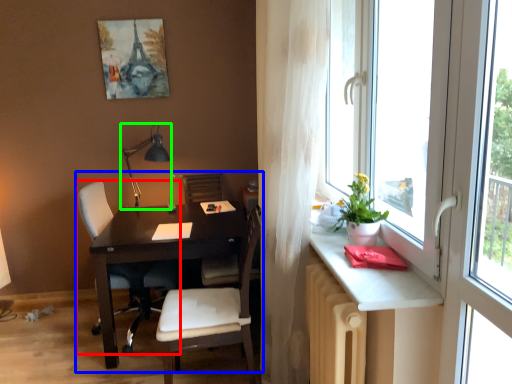
Question: Which object is positioned farthest from chair (highlighted by a red box)? Select from computer desk (highlighted by a blue box) and table lamp (highlighted by a green box).

Choices:
 (A) computer desk
 (B) table lamp

Answer: (B)